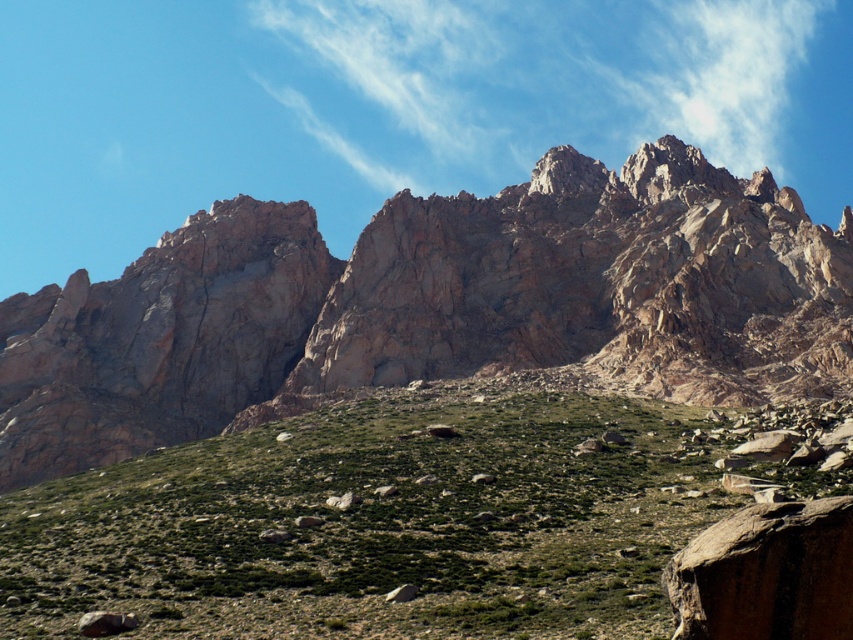
Question: Is rugged rock mountain range at upper center below green grassy hillside at lower center?

Choices:
 (A) no
 (B) yes

Answer: (A)

Question: Which point is farther to the camera?

Choices:
 (A) (36, 616)
 (B) (450, 294)

Answer: (B)

Question: Can you confirm if rugged rock mountain range at upper center is thinner than green grassy hillside at lower center?

Choices:
 (A) no
 (B) yes

Answer: (A)

Question: Is rugged rock mountain range at upper center bigger than green grassy hillside at lower center?

Choices:
 (A) yes
 (B) no

Answer: (A)

Question: Which of the following is the closest to the observer?

Choices:
 (A) (592, 314)
 (B) (656, 490)

Answer: (B)